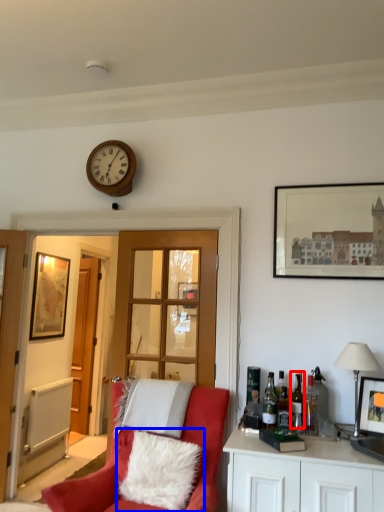
Question: Among these objects, which one is farthest to the camera, wine bottle (highlighted by a red box) or pillow (highlighted by a blue box)?

Choices:
 (A) wine bottle
 (B) pillow

Answer: (A)